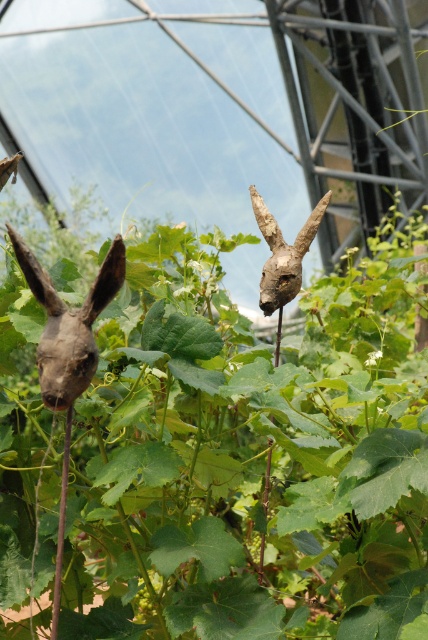
Question: Does green leafy plant at center appear on the left side of wooden rabbit head at left?

Choices:
 (A) no
 (B) yes

Answer: (A)

Question: Which object appears closest to the camera in this image?

Choices:
 (A) wooden rabbit head at left
 (B) wooden rabbit head at center

Answer: (A)

Question: Can you confirm if green leafy plant at center is wider than wooden rabbit head at center?

Choices:
 (A) yes
 (B) no

Answer: (A)

Question: Which object is closer to the camera taking this photo?

Choices:
 (A) green leafy plant at center
 (B) wooden rabbit head at left

Answer: (B)

Question: Which point is farther to the camera?

Choices:
 (A) (308, 406)
 (B) (59, 348)
 (C) (291, 284)

Answer: (A)

Question: Does green leafy plant at center have a greater width compared to wooden rabbit head at center?

Choices:
 (A) yes
 (B) no

Answer: (A)